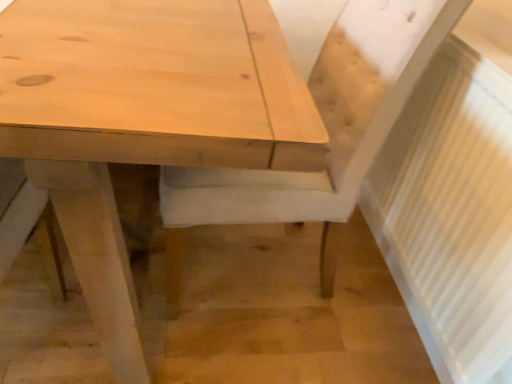
Question: From the image's perspective, is natural wood chair at center below natural wood table at center?

Choices:
 (A) yes
 (B) no

Answer: (B)

Question: Can you confirm if natural wood chair at center is positioned to the left of natural wood table at center?

Choices:
 (A) no
 (B) yes

Answer: (A)

Question: Is natural wood chair at center positioned with its back to natural wood table at center?

Choices:
 (A) no
 (B) yes

Answer: (A)

Question: Can you confirm if natural wood chair at center is smaller than natural wood table at center?

Choices:
 (A) yes
 (B) no

Answer: (A)

Question: From a real-world perspective, is natural wood chair at center positioned over natural wood table at center based on gravity?

Choices:
 (A) no
 (B) yes

Answer: (B)

Question: From the image's perspective, is natural wood chair at center located above or below white textured radiator at right?

Choices:
 (A) below
 (B) above

Answer: (B)

Question: From a real-world perspective, is natural wood chair at center positioned above or below white textured radiator at right?

Choices:
 (A) below
 (B) above

Answer: (A)

Question: Which is correct: natural wood chair at center is inside white textured radiator at right, or outside of it?

Choices:
 (A) outside
 (B) inside

Answer: (A)

Question: Visually, is natural wood chair at center positioned to the left or to the right of white textured radiator at right?

Choices:
 (A) right
 (B) left

Answer: (B)

Question: From a real-world perspective, is white textured radiator at right physically located above or below natural wood table at center?

Choices:
 (A) below
 (B) above

Answer: (B)

Question: In the image, is white textured radiator at right positioned in front of or behind natural wood table at center?

Choices:
 (A) front
 (B) behind

Answer: (B)

Question: Visually, is white textured radiator at right positioned to the left or to the right of natural wood table at center?

Choices:
 (A) right
 (B) left

Answer: (A)

Question: Which is correct: white textured radiator at right is inside natural wood table at center, or outside of it?

Choices:
 (A) outside
 (B) inside

Answer: (A)

Question: Is natural wood chair at center taller or shorter than natural wood table at center?

Choices:
 (A) short
 (B) tall

Answer: (B)

Question: Looking at the image, does natural wood chair at center seem bigger or smaller compared to natural wood table at center?

Choices:
 (A) small
 (B) big

Answer: (A)